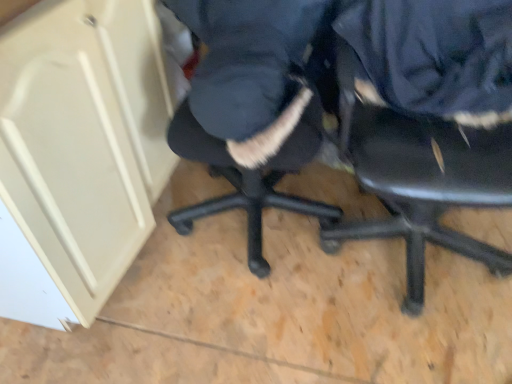
Question: Should I look upward or downward to see black plastic chair at center?

Choices:
 (A) down
 (B) up

Answer: (B)

Question: Is navy blue fabric at upper right, the 2th clothing from the left, in front of navy blue fabric at center, the 1th clothing in the left-to-right sequence?

Choices:
 (A) yes
 (B) no

Answer: (B)

Question: Is navy blue fabric at upper right, the 2th clothing from the left, taller than navy blue fabric at center, the second clothing from the right?

Choices:
 (A) no
 (B) yes

Answer: (A)

Question: Can you confirm if navy blue fabric at upper right, the 2th clothing from the left, is wider than navy blue fabric at center, the 1th clothing in the left-to-right sequence?

Choices:
 (A) yes
 (B) no

Answer: (B)

Question: From the image's perspective, does navy blue fabric at upper right, the 2th clothing from the left, appear lower than navy blue fabric at center, the second clothing from the right?

Choices:
 (A) yes
 (B) no

Answer: (A)

Question: Does navy blue fabric at upper right, which ranks as the first clothing in right-to-left order, turn towards navy blue fabric at center, the second clothing from the right?

Choices:
 (A) no
 (B) yes

Answer: (A)

Question: Considering the relative sizes of navy blue fabric at upper right, which ranks as the first clothing in right-to-left order, and navy blue fabric at center, the second clothing from the right, in the image provided, is navy blue fabric at upper right, which ranks as the first clothing in right-to-left order, smaller than navy blue fabric at center, the second clothing from the right,?

Choices:
 (A) yes
 (B) no

Answer: (A)

Question: Does black plastic chair at center come in front of navy blue fabric at upper right, which ranks as the first clothing in right-to-left order?

Choices:
 (A) no
 (B) yes

Answer: (B)

Question: Can you confirm if black plastic chair at center is wider than navy blue fabric at upper right, which ranks as the first clothing in right-to-left order?

Choices:
 (A) no
 (B) yes

Answer: (B)

Question: From a real-world perspective, is black plastic chair at center below navy blue fabric at upper right, which ranks as the first clothing in right-to-left order?

Choices:
 (A) yes
 (B) no

Answer: (A)

Question: Is black plastic chair at center at the left side of navy blue fabric at upper right, which ranks as the first clothing in right-to-left order?

Choices:
 (A) yes
 (B) no

Answer: (B)

Question: From the image's perspective, is black plastic chair at center under navy blue fabric at upper right, the 2th clothing from the left?

Choices:
 (A) no
 (B) yes

Answer: (B)

Question: Can you confirm if black plastic chair at center is thinner than navy blue fabric at upper right, the 2th clothing from the left?

Choices:
 (A) no
 (B) yes

Answer: (A)

Question: Is black plastic chair at center outside of navy blue fabric at center, the second clothing from the right?

Choices:
 (A) yes
 (B) no

Answer: (A)